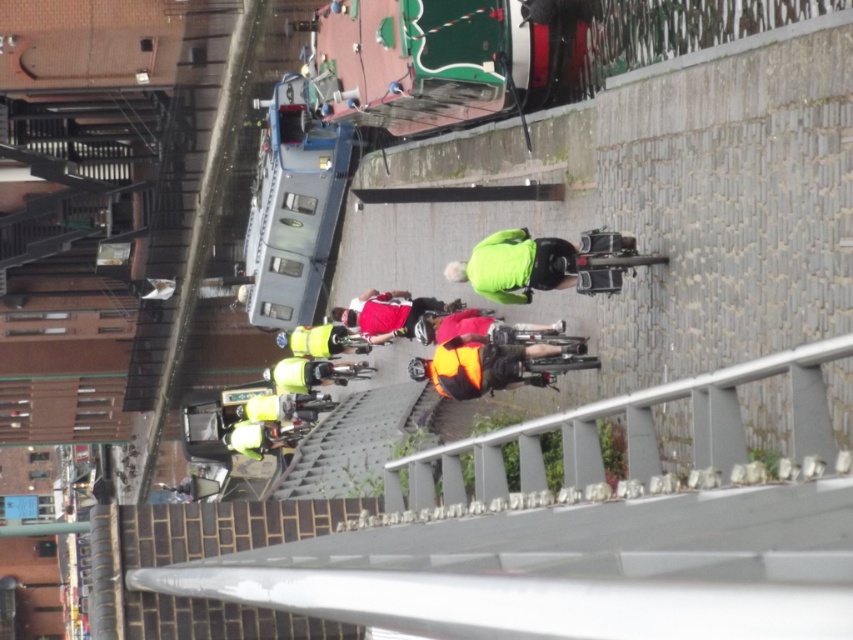
Question: Among these points, which one is farthest from the camera?

Choices:
 (A) (523, 230)
 (B) (434, 339)
 (C) (325, 326)

Answer: (C)

Question: Which point is farther from the camera taking this photo?

Choices:
 (A) (311, 330)
 (B) (502, 260)
 (C) (445, 394)

Answer: (A)

Question: Estimate the real-world distances between objects in this image. Which object is farther from the reflective red jacket at center?

Choices:
 (A) neon green jacket at center
 (B) high visibility orange vest at center
 (C) reflective orange vest at center
 (D) high visibility yellow jacket at center

Answer: (A)

Question: Is reflective red jacket at center above reflective orange vest at center?

Choices:
 (A) no
 (B) yes

Answer: (B)

Question: Is neon green jacket at center positioned at the back of high visibility yellow jacket at center?

Choices:
 (A) yes
 (B) no

Answer: (B)

Question: Can you confirm if high visibility orange vest at center is positioned above reflective orange vest at center?

Choices:
 (A) no
 (B) yes

Answer: (A)